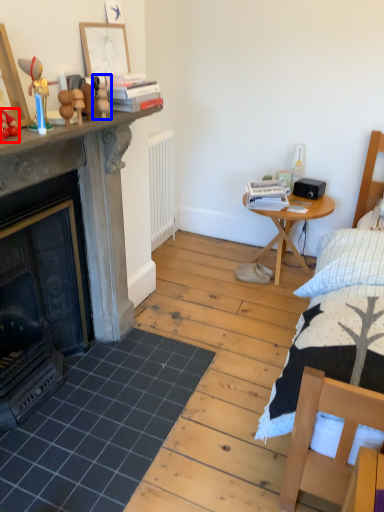
Question: Among these objects, which one is farthest to the camera, toy (highlighted by a red box) or toy (highlighted by a blue box)?

Choices:
 (A) toy
 (B) toy

Answer: (B)